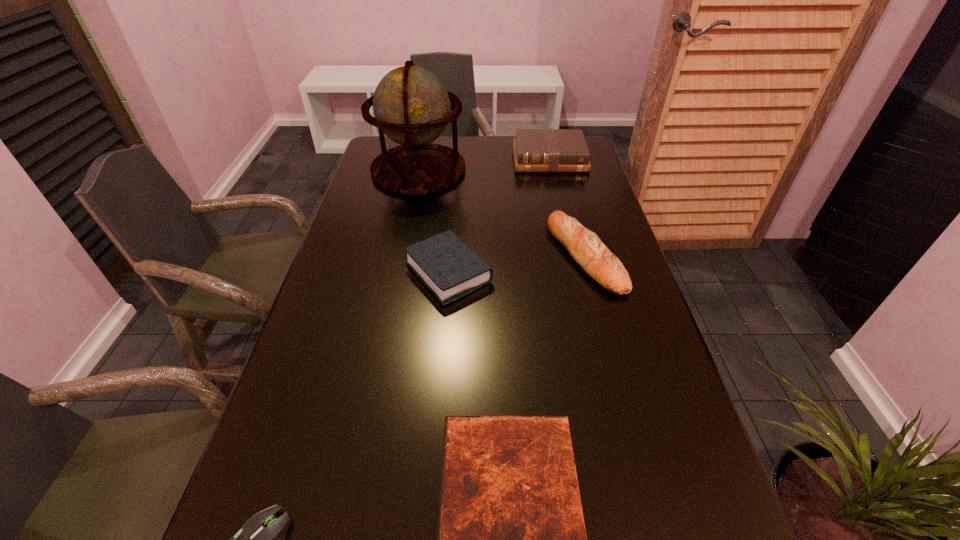
This screenshot has height=540, width=960. In order to click on globe in this screenshot , I will do `click(411, 105)`.

Locate an element on the screen. the tallest Bible is located at coordinates pyautogui.click(x=535, y=150).

Locate an element on the screen. Image resolution: width=960 pixels, height=540 pixels. baguet is located at coordinates (585, 247).

Locate an element on the screen. The image size is (960, 540). the second farthest Bible is located at coordinates (451, 270).

The width and height of the screenshot is (960, 540). Identify the location of vacant region located on the front-facing side of the globe. (398, 272).

Locate an element on the screen. vacant space located on the spine side of the tallest Bible is located at coordinates (570, 249).

This screenshot has height=540, width=960. I want to click on vacant space located 0.250m on the back of the baguet, so click(564, 177).

Identify the location of free space located 0.120m on the left of the second nearest Bible. This screenshot has height=540, width=960. (357, 273).

Locate an element on the screen. globe that is at the far edge is located at coordinates (411, 105).

Image resolution: width=960 pixels, height=540 pixels. Identify the location of Bible that is at the far edge. (535, 150).